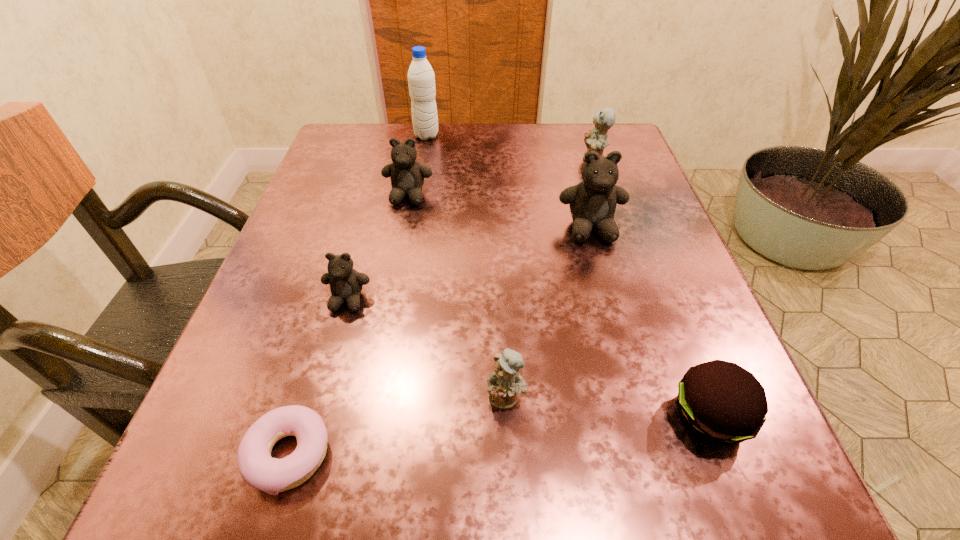
Select which object is the sixth closest to the biggest brown teddy bear. Please provide its 2D coordinates. Your answer should be formatted as a tuple, i.e. [(x, y)], where the tuple contains the x and y coordinates of a point satisfying the conditions above.

[(421, 79)]

The image size is (960, 540). I want to click on teddy bear that stands as the second closest to the patty, so click(x=592, y=202).

Identify which teddy bear is located as the nearest to the fourth nearest teddy bear. Please provide its 2D coordinates. Your answer should be formatted as a tuple, i.e. [(x, y)], where the tuple contains the x and y coordinates of a point satisfying the conditions above.

[(346, 284)]

Choose which brown teddy bear is the second nearest neighbor to the farthest object. Please provide its 2D coordinates. Your answer should be formatted as a tuple, i.e. [(x, y)], where the tuple contains the x and y coordinates of a point satisfying the conditions above.

[(592, 202)]

The height and width of the screenshot is (540, 960). Identify the location of brown teddy bear that is the closest to the fifth farthest object. (407, 175).

What are the coordinates of `blank space that satisfies the following two spatial constraints: 1. on the back side of the pink doughnut; 2. on the left side of the patty` in the screenshot? It's located at (300, 417).

Locate an element on the screen. Image resolution: width=960 pixels, height=540 pixels. free spot that satisfies the following two spatial constraints: 1. on the face of the rightmost brown teddy bear; 2. on the right side of the patty is located at coordinates (641, 417).

Identify the location of free space that satisfies the following two spatial constraints: 1. on the front-facing side of the farthest teddy bear; 2. on the face of the third farthest teddy bear. This screenshot has height=540, width=960. (617, 229).

Identify the location of free space that satisfies the following two spatial constraints: 1. on the front-facing side of the bigger blue teddy bear; 2. on the front-facing side of the nearest teddy bear. (674, 397).